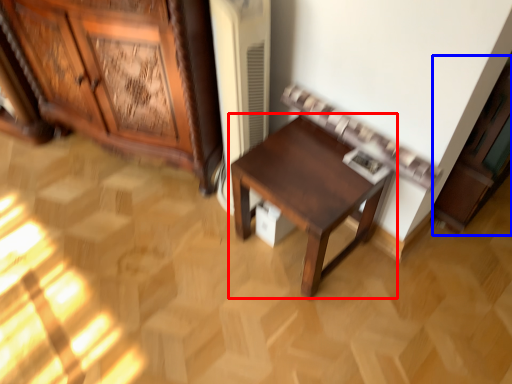
Question: Among these objects, which one is farthest to the camera, table (highlighted by a red box) or cabinetry (highlighted by a blue box)?

Choices:
 (A) table
 (B) cabinetry

Answer: (A)